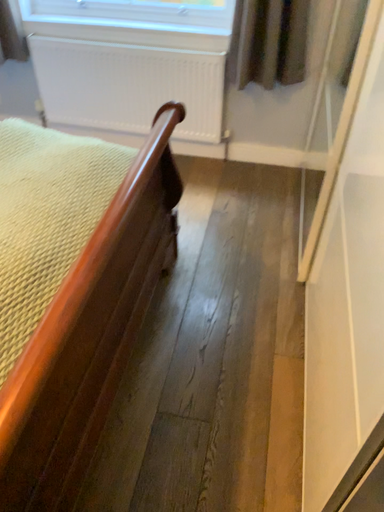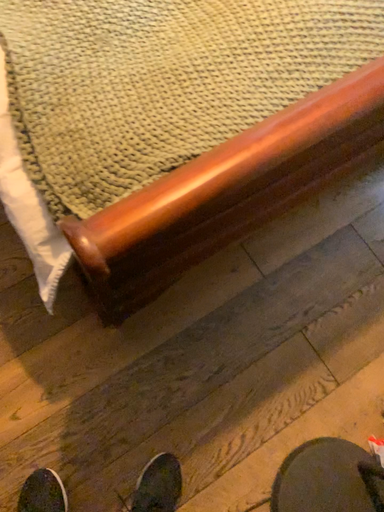
Question: How did the camera likely rotate when shooting the video?

Choices:
 (A) rotated downward
 (B) rotated upward

Answer: (A)